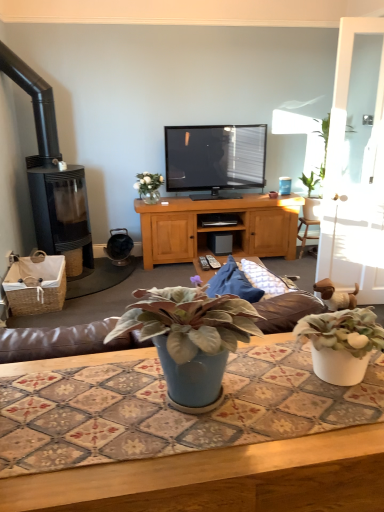
Question: Considering the positions of woven brown picnic basket at lower left and blue matte plant pot at center, acting as the second houseplant starting from the top, in the image, is woven brown picnic basket at lower left taller or shorter than blue matte plant pot at center, acting as the second houseplant starting from the top,?

Choices:
 (A) tall
 (B) short

Answer: (A)

Question: Based on their sizes in the image, would you say woven brown picnic basket at lower left is bigger or smaller than blue matte plant pot at center, the 2th houseplant viewed from the back?

Choices:
 (A) big
 (B) small

Answer: (A)

Question: Which object is positioned closest to the translucent glass vase at upper center?

Choices:
 (A) blue glossy coffee cup at upper right
 (B) blue matte plant pot at center, the first houseplant when ordered from front to back
 (C) black plastic remote control at center, the 2th remote control when ordered from right to left
 (D) white glass door at right
 (E) white plastic remote control at center, which is the second remote control from left to right

Answer: (A)

Question: Which is nearer to the blue ceramic table at center?

Choices:
 (A) white plastic remote control at center, which is the second remote control from left to right
 (B) black plastic remote control at center, the 2th remote control when ordered from right to left
 (C) blue matte plant pot at center, acting as the second houseplant starting from the top
 (D) blue glossy coffee cup at upper right
 (E) white glass door at right

Answer: (C)